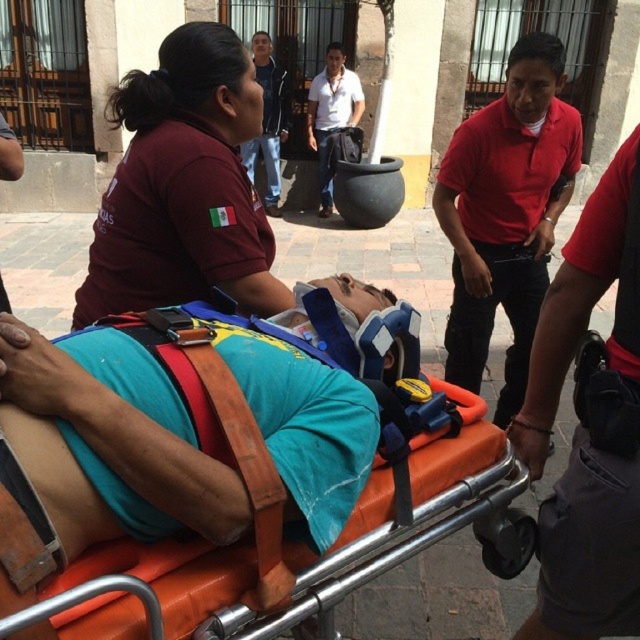
You are a photographer at the scene. You need to capture a clear photo of both the red smooth shirt at center and the white cotton shirt at center. Which shirt will appear smaller in the photo?

The red smooth shirt at center will appear smaller in the photo because it has a lesser height compared to the white cotton shirt at center.

Looking at this image, you are a drone operator tasked with capturing aerial footage of the emergency scene. The drone has a camera with a 100mm lens that can focus clearly on objects within a 15 feet range. You need to ensure both the matte maroon shirt at upper left and the white cotton shirt at center are in focus. Is this possible with the current lens settings?

The matte maroon shirt at upper left and white cotton shirt at center are 20.94 feet apart from each other. Since the drone camera can only focus within a 15 feet range, the distance between them exceeds this limit. Therefore, both cannot be in focus simultaneously with the current lens settings.